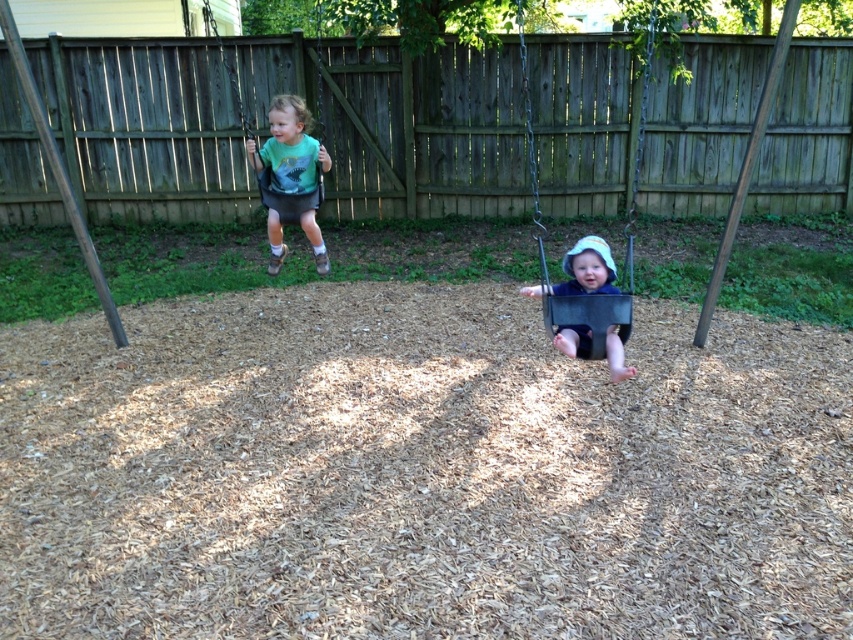
Who is shorter, green t-shirt at upper left or brown wood pole at upper right?

Standing shorter between the two is brown wood pole at upper right.

Who is taller, green t-shirt at upper left or brown wood pole at upper right?

green t-shirt at upper left

Is point (312, 147) less distant than point (762, 109)?

No, it is behind (762, 109).

This screenshot has height=640, width=853. I want to click on green t-shirt at upper left, so click(289, 179).

Is green t-shirt at upper left below matte black swing at center?

Incorrect, green t-shirt at upper left is not positioned below matte black swing at center.

Image resolution: width=853 pixels, height=640 pixels. What do you see at coordinates (289, 179) in the screenshot?
I see `green t-shirt at upper left` at bounding box center [289, 179].

At what (x,y) coordinates should I click in order to perform the action: click on green t-shirt at upper left. Please return your answer as a coordinate pair (x, y). Looking at the image, I should click on (289, 179).

Which is above, brown wood pole at left or matte green fabric swing at upper left?

Positioned higher is matte green fabric swing at upper left.

You are a GUI agent. You are given a task and a screenshot of the screen. Output one action in this format:
    pyautogui.click(x=<x>, y=<y>)
    Task: Click on the brown wood pole at left
    The height and width of the screenshot is (640, 853).
    Given the screenshot: What is the action you would take?
    pyautogui.click(x=57, y=170)